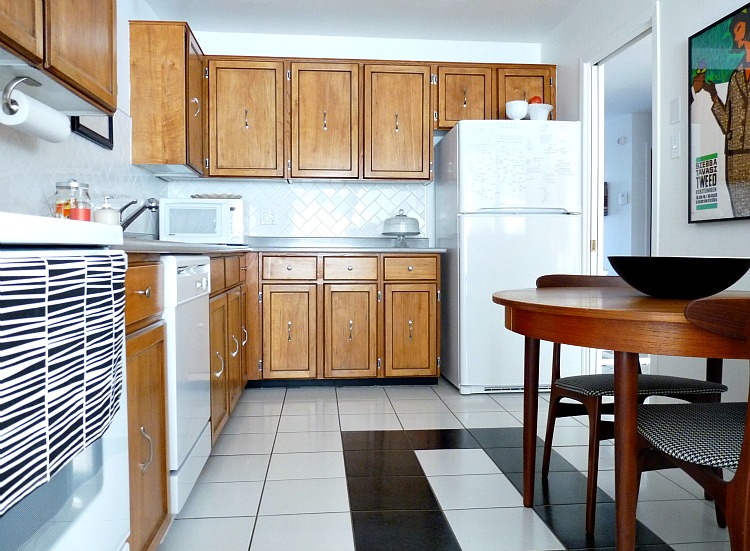
Where is `counter`? This screenshot has height=551, width=750. counter is located at coordinates (304, 241).